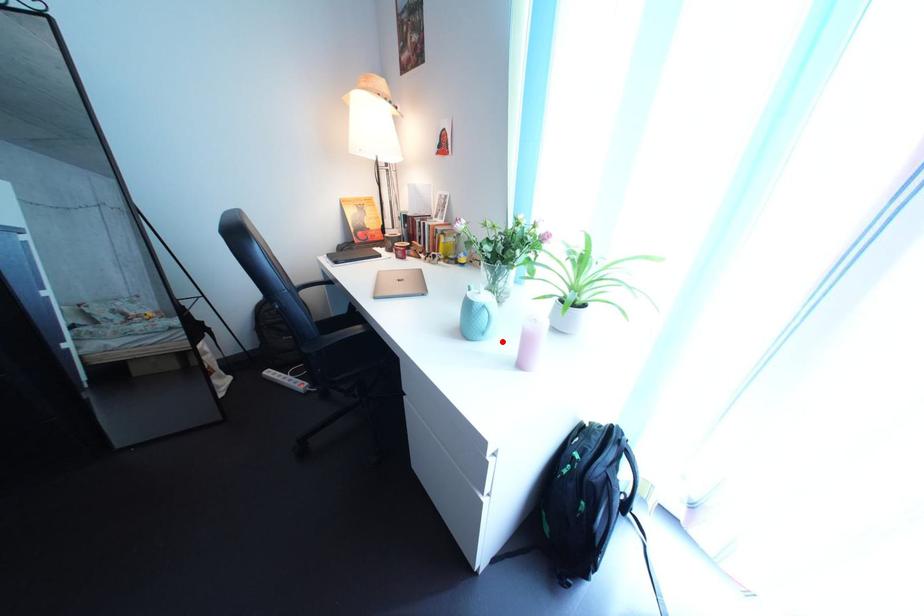
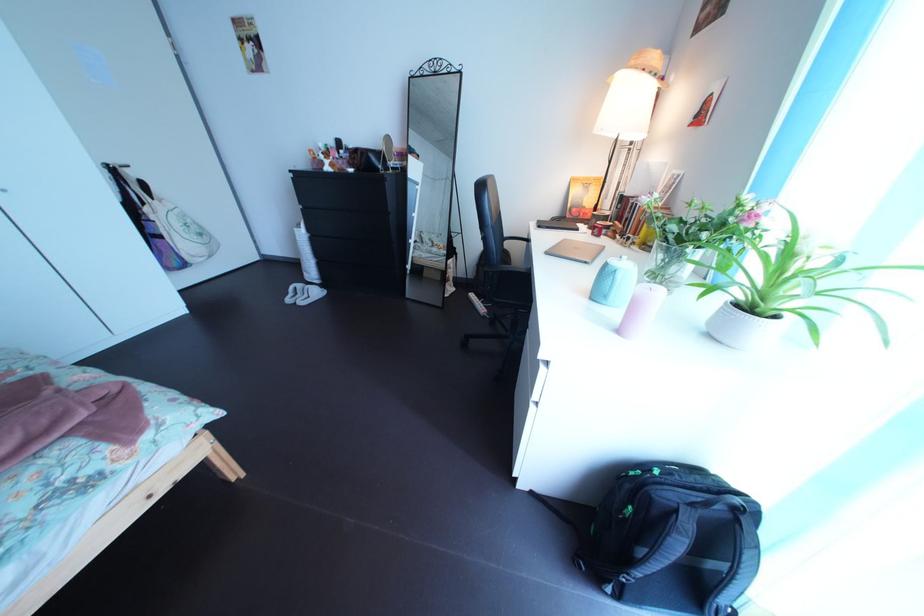
In the second image, find the point that corresponds to the highlighted location in the first image.

(626, 307)